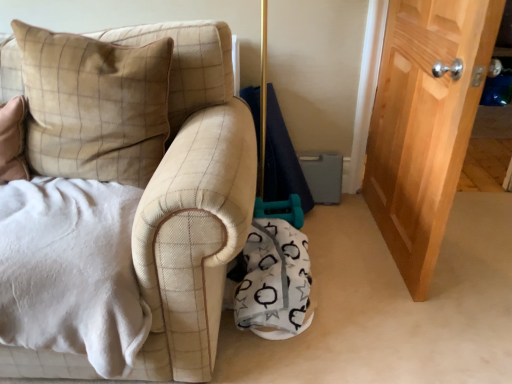
Where is `empty space that is to the right of white fabric blanket at lower center`? This screenshot has height=384, width=512. empty space that is to the right of white fabric blanket at lower center is located at coordinates (370, 288).